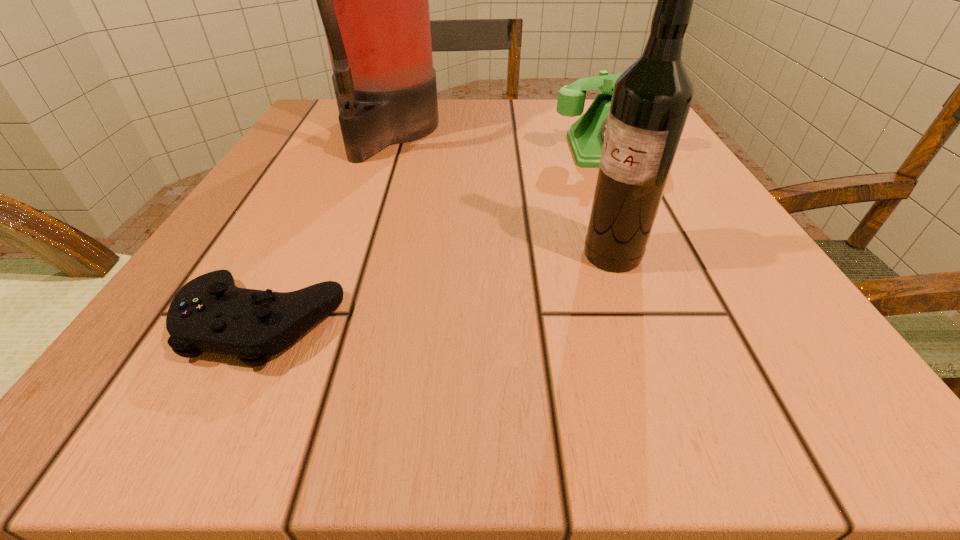
Where is `the tallest object`? This screenshot has height=540, width=960. the tallest object is located at coordinates click(373, 0).

Find the location of a particular element. The height and width of the screenshot is (540, 960). the third shortest object is located at coordinates (651, 100).

Find the location of a particular element. This screenshot has width=960, height=540. wine bottle is located at coordinates 651,100.

In order to click on the second shortest object in this screenshot , I will do `click(586, 136)`.

Identify the location of control. The image size is (960, 540). (210, 313).

At what (x,y) coordinates should I click in order to perform the action: click on the shortest object. Please return your answer as a coordinate pair (x, y). Looking at the image, I should click on (210, 313).

Where is `free space located 0.190m at the nozzle of the tallest object`? This screenshot has width=960, height=540. free space located 0.190m at the nozzle of the tallest object is located at coordinates [x=532, y=133].

The width and height of the screenshot is (960, 540). I want to click on free point located 0.310m on the front and back of the second tallest object, so click(353, 255).

Identify the location of free space located 0.070m on the front and back of the second tallest object. (531, 255).

The height and width of the screenshot is (540, 960). In order to click on free space located 0.080m on the front and back of the second tallest object in this screenshot , I will do `click(523, 255)`.